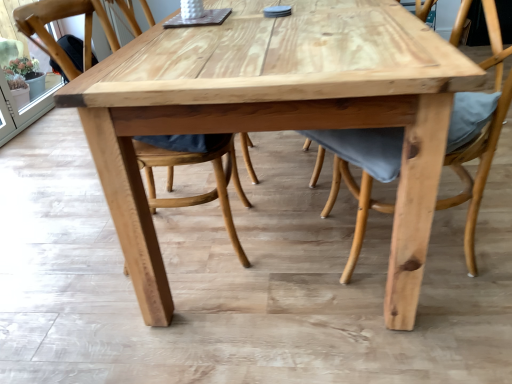
This screenshot has height=384, width=512. I want to click on vacant space to the right of natural wood chair at center, which appears as the 2th chair when viewed from the right, so click(289, 226).